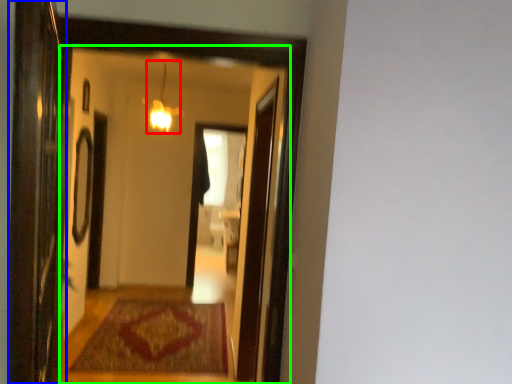
Question: Based on their relative distances, which object is nearer to light fixture (highlighted by a red box)? Choose from screen door (highlighted by a blue box) and mirror (highlighted by a green box).

Choices:
 (A) screen door
 (B) mirror

Answer: (B)